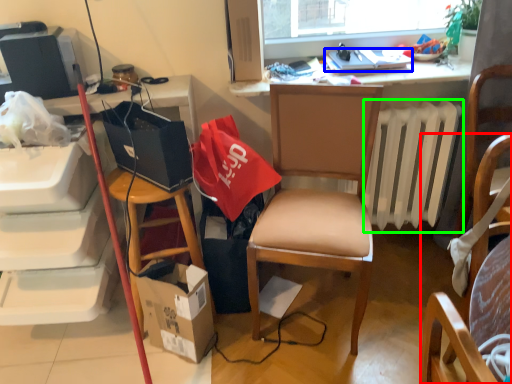
Question: Considering the real-world distances, which object is closest to chair (highlighted by a red box)? laptop (highlighted by a blue box) or radiator (highlighted by a green box).

Choices:
 (A) laptop
 (B) radiator

Answer: (B)